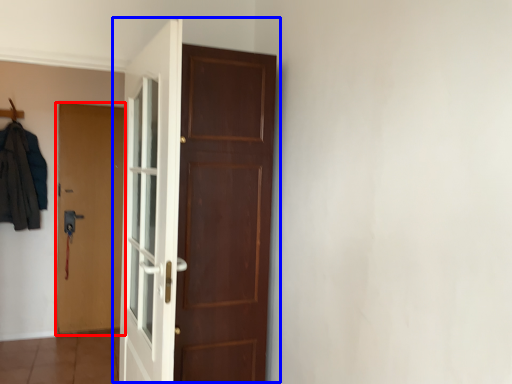
Question: Which of the following is the farthest to the observer, door (highlighted by a red box) or door (highlighted by a blue box)?

Choices:
 (A) door
 (B) door

Answer: (A)